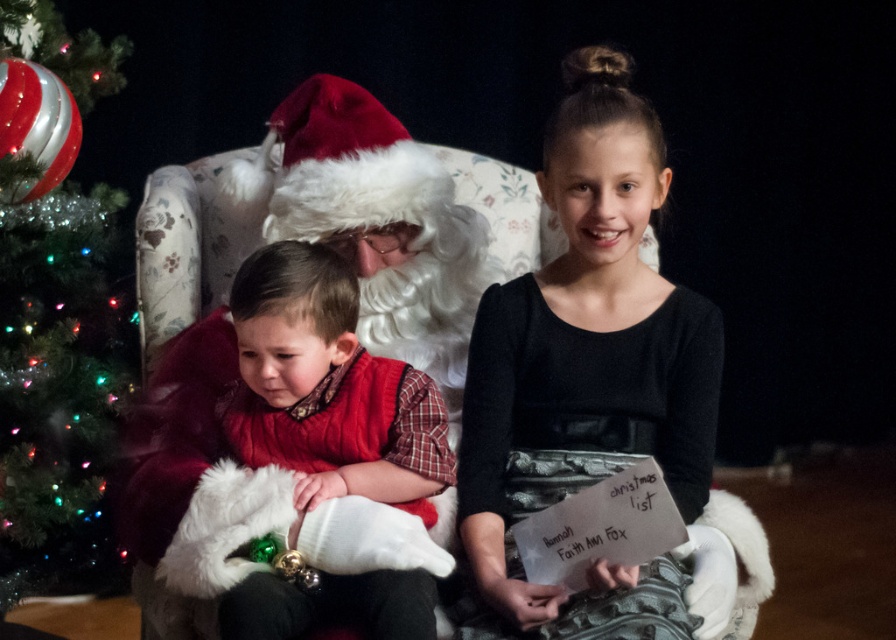
Question: Can you confirm if black satin dress at center is positioned below white paper at center?

Choices:
 (A) yes
 (B) no

Answer: (B)

Question: Which is farther from the matte red vest at center?

Choices:
 (A) white paper at center
 (B) black satin dress at center

Answer: (A)

Question: Can you confirm if black satin dress at center is smaller than matte red vest at center?

Choices:
 (A) yes
 (B) no

Answer: (B)

Question: Which object is the farthest from the white paper at center?

Choices:
 (A) shiny glass ornament at left
 (B) matte red vest at center

Answer: (A)

Question: Which object appears farthest from the camera in this image?

Choices:
 (A) shiny glass ornament at left
 (B) black satin dress at center
 (C) matte red vest at center
 (D) white paper at center

Answer: (A)

Question: Does black satin dress at center have a lesser width compared to matte red vest at center?

Choices:
 (A) yes
 (B) no

Answer: (A)